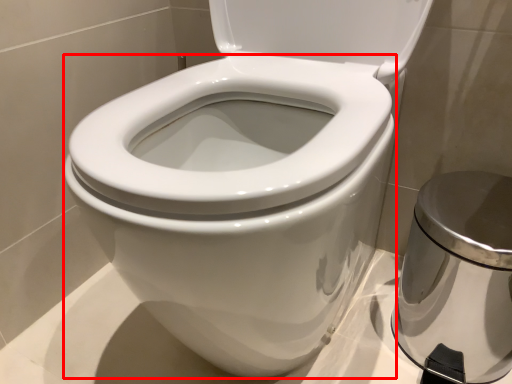
Question: From the image's perspective, where is bidet (annotated by the red box) located relative to porcelain?

Choices:
 (A) below
 (B) above

Answer: (B)